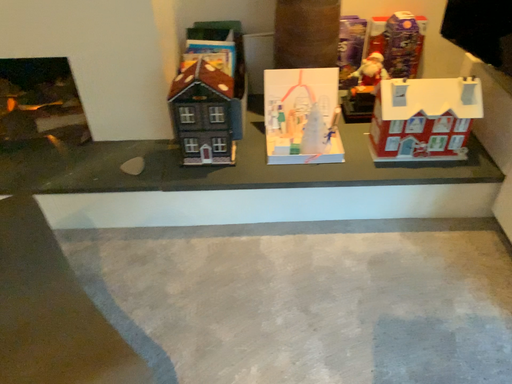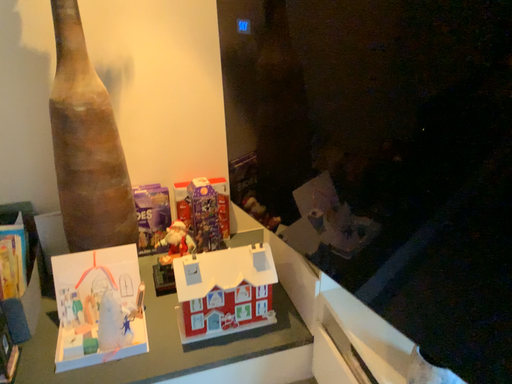
Question: Which way did the camera rotate in the video?

Choices:
 (A) rotated left
 (B) rotated right

Answer: (B)